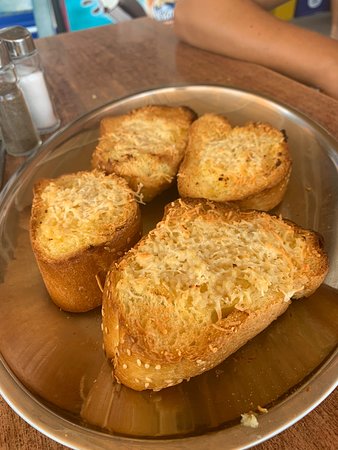
What are the coordinates of `table` in the screenshot? It's located at (x=134, y=63).